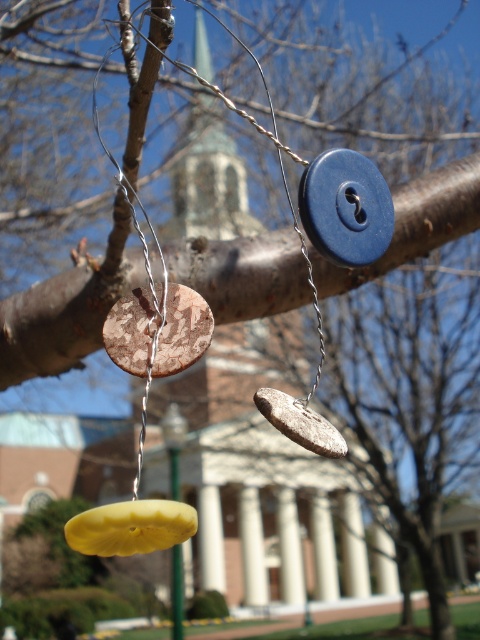
Question: Which object appears farthest from the camera in this image?

Choices:
 (A) yellow matte coin at lower center
 (B) rustic wood coin at center

Answer: (B)

Question: Is blue matte button at center above yellow matte coin at lower center?

Choices:
 (A) no
 (B) yes

Answer: (B)

Question: Can you confirm if yellow matte coin at lower center is positioned to the right of rusty metallic coin at center?

Choices:
 (A) no
 (B) yes

Answer: (A)

Question: Considering the relative positions of yellow matte coin at lower center and rusty metallic coin at center in the image provided, where is yellow matte coin at lower center located with respect to rusty metallic coin at center?

Choices:
 (A) below
 (B) above

Answer: (A)

Question: Which object is closer to the camera taking this photo?

Choices:
 (A) rusty metallic coin at center
 (B) yellow matte coin at lower center

Answer: (B)

Question: Which point is closer to the camera taking this photo?

Choices:
 (A) (x=348, y=205)
 (B) (x=266, y=413)
 (C) (x=97, y=536)
 (D) (x=145, y=336)

Answer: (C)